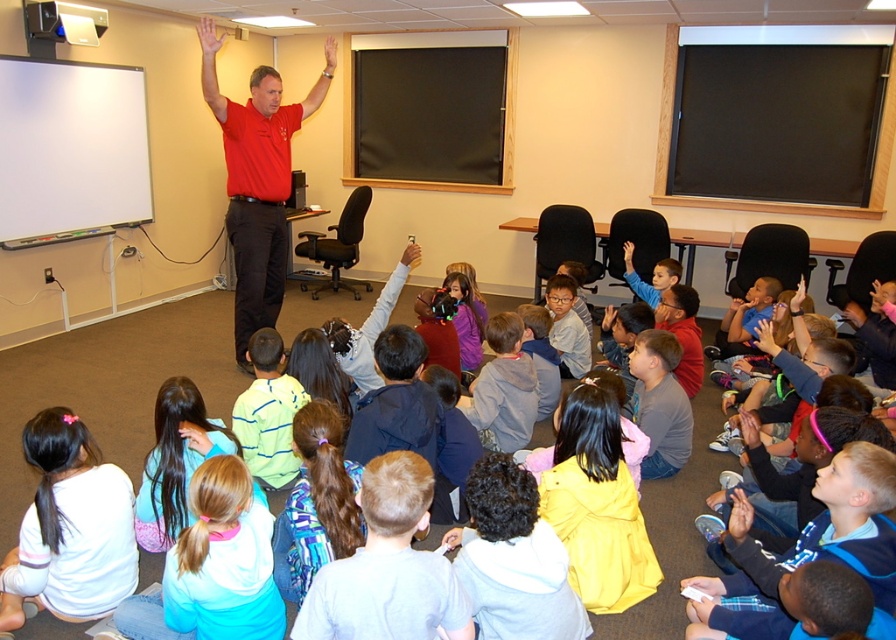
Question: Is white matte shirt at lower left to the left of gray hoodie at center from the viewer's perspective?

Choices:
 (A) yes
 (B) no

Answer: (A)

Question: Can you confirm if pink fabric hair tie at lower center is thinner than gray hoodie at center?

Choices:
 (A) no
 (B) yes

Answer: (A)

Question: Can you confirm if yellow matte jacket at lower center is positioned above light blue fleece jacket at lower left?

Choices:
 (A) no
 (B) yes

Answer: (A)

Question: Which point is farther from the camera taking this photo?

Choices:
 (A) (662, 269)
 (B) (261, 198)

Answer: (A)

Question: Estimate the real-world distances between objects in this image. Which object is closer to the matte red shirt at center?

Choices:
 (A) pink fabric hair tie at lower center
 (B) light blue fleece jacket at lower left
 (C) yellow matte jacket at lower center

Answer: (B)

Question: Among these points, which one is nearest to the camera?

Choices:
 (A) (205, 637)
 (B) (653, 273)
 (C) (188, 461)
 (D) (490, 376)

Answer: (A)